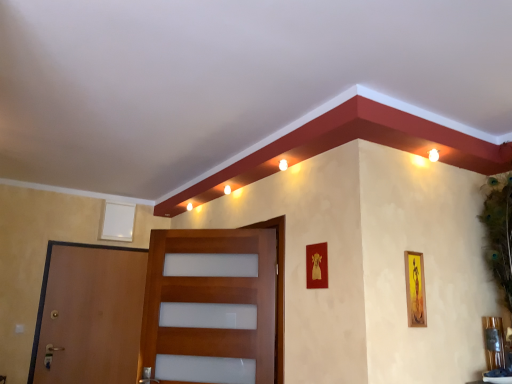
Question: Based on their sizes in the image, would you say brown wooden door at left, which is the 2th door in front-to-back order, is bigger or smaller than yellow matte picture frame at right, placed as the third picture frame when sorted from left to right?

Choices:
 (A) small
 (B) big

Answer: (B)

Question: Considering their positions, is brown wooden door at left, arranged as the first door when viewed from the left, located in front of or behind yellow matte picture frame at right, which is the 1th picture frame from front to back?

Choices:
 (A) front
 (B) behind

Answer: (B)

Question: Which object is the closest to the brown wooden door at left, which is counted as the first door, starting from the back?

Choices:
 (A) white matte picture frame at upper left, arranged as the third picture frame when viewed from the front
 (B) yellow matte picture frame at right, which is the 1th picture frame from front to back
 (C) gold metallic picture frame at center, marked as the second picture frame in a front-to-back arrangement
 (D) wooden door at center, positioned as the 2th door in left-to-right order

Answer: (A)

Question: Estimate the real-world distances between objects in this image. Which object is farther from the wooden door at center, placed as the 2th door when sorted from back to front?

Choices:
 (A) yellow matte picture frame at right, the third picture frame when ordered from back to front
 (B) white matte picture frame at upper left, arranged as the third picture frame when viewed from the right
 (C) brown wooden door at left, which is counted as the first door, starting from the back
 (D) gold metallic picture frame at center, which appears as the second picture frame when viewed from the right

Answer: (B)